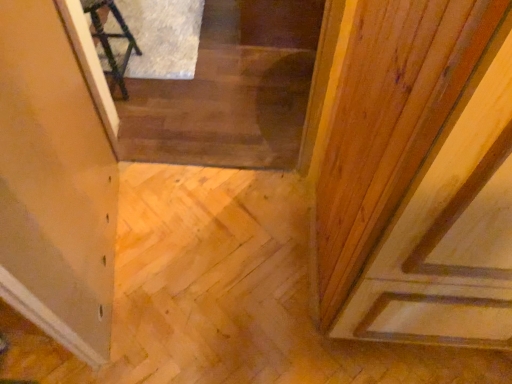
This screenshot has width=512, height=384. In order to click on free spot behind transparent glass door at upper left in this screenshot , I will do `click(163, 198)`.